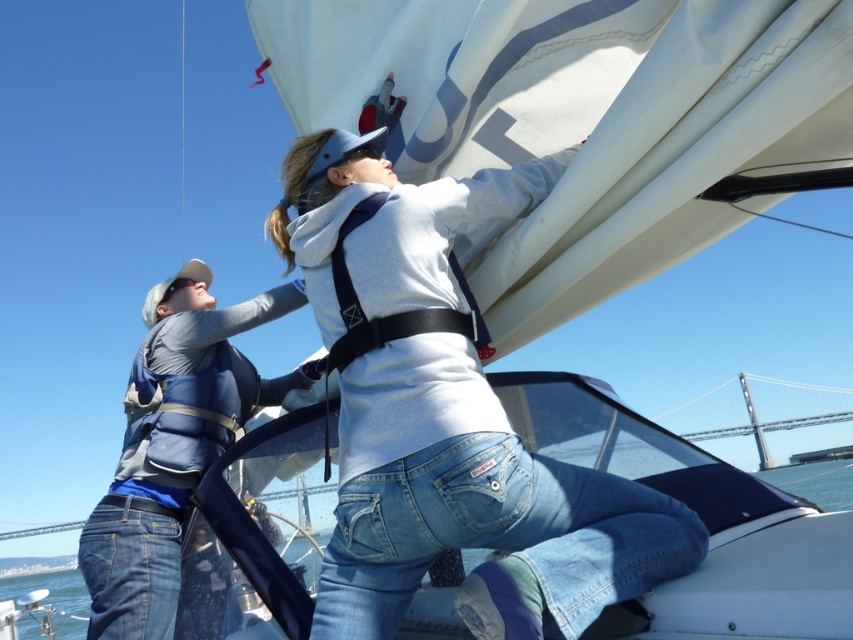
Is matte gray hoodie at center above blue fabric life vest at left?

Yes.

Locate an element on the screen. The image size is (853, 640). matte gray hoodie at center is located at coordinates (447, 417).

Is point (345, 381) closer to viewer compared to point (222, 433)?

Yes.

I want to click on matte gray hoodie at center, so click(447, 417).

In the scene shown: Which is below, blue denim jeans at lower center or blue fabric life vest at left?

Positioned lower is blue denim jeans at lower center.

Can you confirm if blue denim jeans at lower center is bigger than blue fabric life vest at left?

Yes, blue denim jeans at lower center is bigger than blue fabric life vest at left.

Is point (228, 490) positioned behind point (126, 384)?

No, (228, 490) is in front of (126, 384).

I want to click on blue denim jeans at lower center, so click(x=700, y=516).

Locate an element on the screen. blue fabric life vest at left is located at coordinates (173, 444).

Based on the photo, who is lower down, blue fabric life vest at left or metallic gray bridge at upper right?

Positioned lower is metallic gray bridge at upper right.

Who is more forward, (140,576) or (761,440)?

Point (140,576) is more forward.

Find the location of a particular element. blue fabric life vest at left is located at coordinates (173, 444).